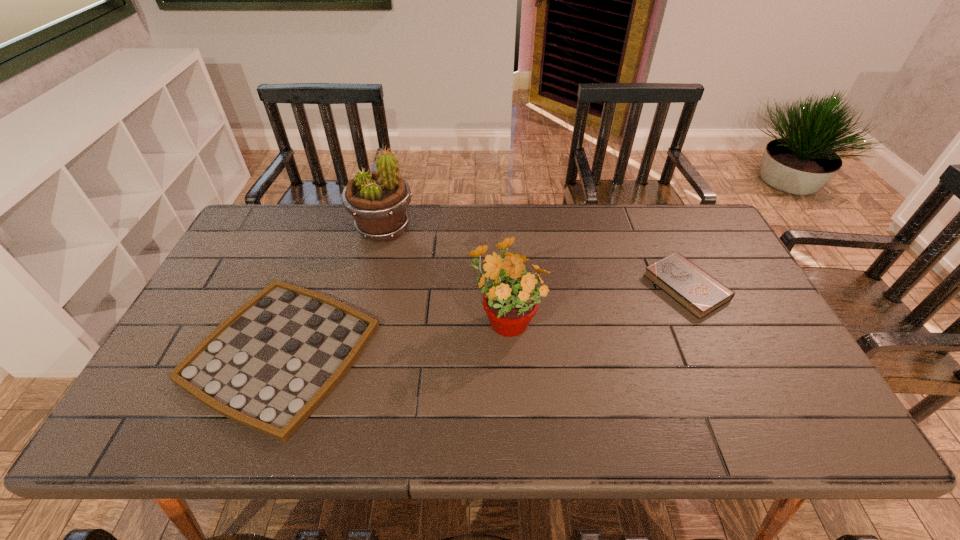
Where is `vacant space at the far right corner of the desktop`? vacant space at the far right corner of the desktop is located at coordinates (701, 225).

This screenshot has width=960, height=540. I want to click on free space between the left flowerpot and the nearer flowerpot, so click(444, 273).

At what (x,y) coordinates should I click in order to perform the action: click on free space between the third tallest object and the checkerboard. Please return your answer as a coordinate pair (x, y). This screenshot has height=540, width=960. Looking at the image, I should click on (484, 320).

Image resolution: width=960 pixels, height=540 pixels. What are the coordinates of `free space between the right flowerpot and the shortest object` in the screenshot? It's located at (394, 335).

Find the location of a particular element. The width and height of the screenshot is (960, 540). vacant area between the right flowerpot and the rightmost object is located at coordinates (596, 302).

Locate an element on the screen. free spot between the farthest object and the checkerboard is located at coordinates (x=332, y=291).

Identify the location of empty space that is in between the nearer flowerpot and the shortest object. (394, 335).

Locate an element on the screen. This screenshot has height=540, width=960. free spot between the shortest object and the rightmost object is located at coordinates (484, 320).

Identify the location of vacant space in between the farthest object and the rightmost object. (535, 258).

The image size is (960, 540). Find the location of `vacant space that's between the third tallest object and the left flowerpot`. vacant space that's between the third tallest object and the left flowerpot is located at coordinates (535, 258).